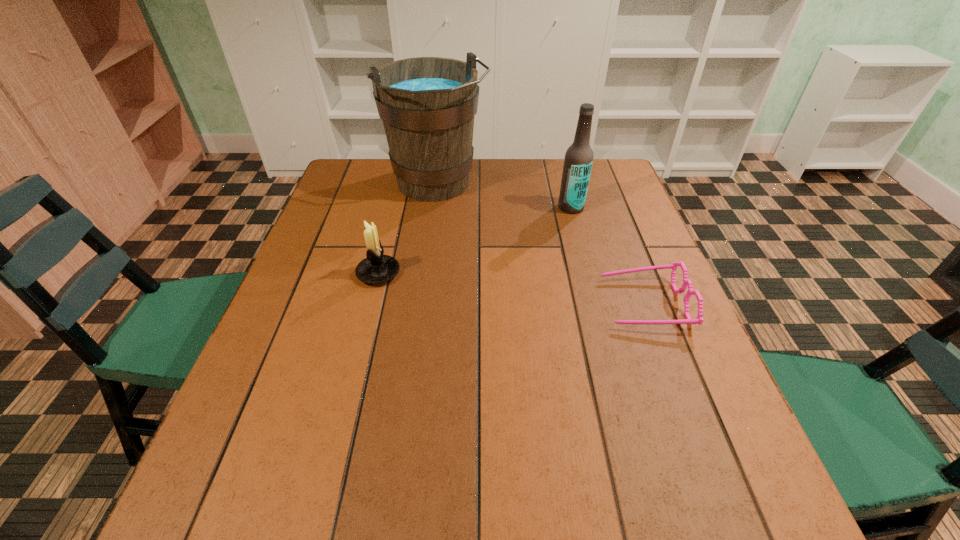
Find the location of a particular element. The height and width of the screenshot is (540, 960). free space on the desktop that is between the third tallest object and the shortest object and is positioned with a handle on the side of the wine bucket is located at coordinates (518, 289).

Image resolution: width=960 pixels, height=540 pixels. What are the coordinates of `free space on the desktop that is between the third tallest object and the spectacles and is positioned on the label of the beer bottle` in the screenshot? It's located at (491, 286).